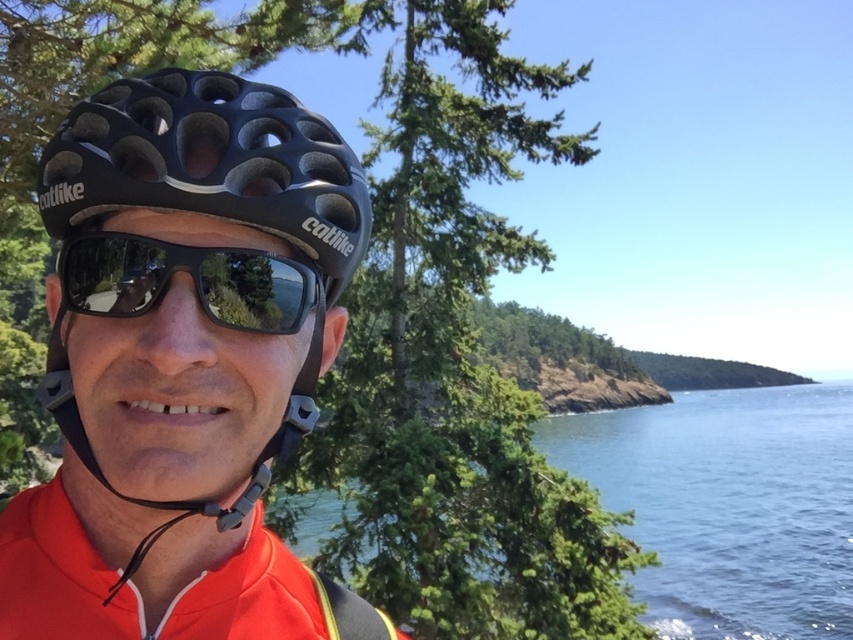
Question: Where is black matte bicycle helmet at center located in relation to black matte sunglasses at center in the image?

Choices:
 (A) above
 (B) below

Answer: (A)

Question: Which object is closer to the camera taking this photo?

Choices:
 (A) black matte bicycle helmet at center
 (B) blue liquid water at center
 (C) black matte sunglasses at center

Answer: (A)

Question: Is blue liquid water at center further to camera compared to black matte sunglasses at center?

Choices:
 (A) yes
 (B) no

Answer: (A)

Question: Among these objects, which one is nearest to the camera?

Choices:
 (A) black matte sunglasses at center
 (B) blue liquid water at center
 (C) black matte bicycle helmet at center

Answer: (C)

Question: Does black matte bicycle helmet at center appear over black matte sunglasses at center?

Choices:
 (A) no
 (B) yes

Answer: (B)

Question: Considering the real-world distances, which object is farthest from the black matte bicycle helmet at center?

Choices:
 (A) blue liquid water at center
 (B) black matte sunglasses at center

Answer: (A)